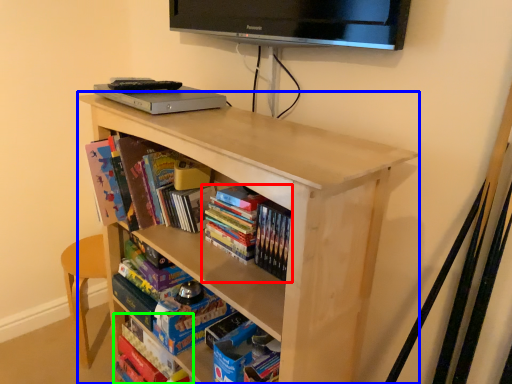
Question: Estimate the real-world distances between objects in this image. Which object is closer to book (highlighted by a red box), shelf (highlighted by a blue box) or book (highlighted by a green box)?

Choices:
 (A) shelf
 (B) book

Answer: (A)